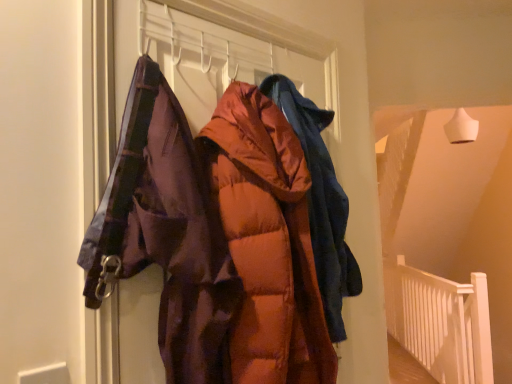
Question: Can you confirm if white wooden balustrade at lower right is smaller than matte orange puffer jacket at center, marked as the 2th jacket in a front-to-back arrangement?

Choices:
 (A) no
 (B) yes

Answer: (A)

Question: Considering the relative sizes of white wooden balustrade at lower right and matte orange puffer jacket at center, marked as the 2th jacket in a front-to-back arrangement, in the image provided, is white wooden balustrade at lower right bigger than matte orange puffer jacket at center, marked as the 2th jacket in a front-to-back arrangement,?

Choices:
 (A) yes
 (B) no

Answer: (A)

Question: Does white wooden balustrade at lower right have a greater width compared to matte orange puffer jacket at center, marked as the 2th jacket in a front-to-back arrangement?

Choices:
 (A) no
 (B) yes

Answer: (A)

Question: From a real-world perspective, is white wooden balustrade at lower right over matte orange puffer jacket at center, the first jacket in the back-to-front sequence?

Choices:
 (A) no
 (B) yes

Answer: (A)

Question: Is white wooden balustrade at lower right directly adjacent to matte orange puffer jacket at center, the first jacket in the back-to-front sequence?

Choices:
 (A) no
 (B) yes

Answer: (A)

Question: Looking at their shapes, would you say white wooden balustrade at lower right is wider or thinner than matte orange puffer jacket at center, the first jacket in the back-to-front sequence?

Choices:
 (A) thin
 (B) wide

Answer: (A)

Question: Considering the positions of white wooden balustrade at lower right and matte orange puffer jacket at center, marked as the 2th jacket in a front-to-back arrangement, in the image, is white wooden balustrade at lower right bigger or smaller than matte orange puffer jacket at center, marked as the 2th jacket in a front-to-back arrangement,?

Choices:
 (A) big
 (B) small

Answer: (A)

Question: Is white wooden balustrade at lower right inside the boundaries of matte orange puffer jacket at center, marked as the 2th jacket in a front-to-back arrangement, or outside?

Choices:
 (A) outside
 (B) inside

Answer: (A)

Question: In the image, is white wooden balustrade at lower right positioned in front of or behind matte orange puffer jacket at center, marked as the 2th jacket in a front-to-back arrangement?

Choices:
 (A) behind
 (B) front

Answer: (A)

Question: Considering the positions of matte orange puffer jacket at center, the first jacket in the back-to-front sequence, and white wooden balustrade at lower right in the image, is matte orange puffer jacket at center, the first jacket in the back-to-front sequence, taller or shorter than white wooden balustrade at lower right?

Choices:
 (A) tall
 (B) short

Answer: (B)

Question: Considering the relative positions of matte orange puffer jacket at center, marked as the 2th jacket in a front-to-back arrangement, and white wooden balustrade at lower right in the image provided, is matte orange puffer jacket at center, marked as the 2th jacket in a front-to-back arrangement, to the left or to the right of white wooden balustrade at lower right?

Choices:
 (A) right
 (B) left

Answer: (B)

Question: Is matte orange puffer jacket at center, marked as the 2th jacket in a front-to-back arrangement, inside the boundaries of white wooden balustrade at lower right, or outside?

Choices:
 (A) inside
 (B) outside

Answer: (B)

Question: Looking at their shapes, would you say matte orange puffer jacket at center, marked as the 2th jacket in a front-to-back arrangement, is wider or thinner than white wooden balustrade at lower right?

Choices:
 (A) thin
 (B) wide

Answer: (B)

Question: Considering their positions, is orange puffy jacket at center, the second jacket in the back-to-front sequence, located in front of or behind matte orange puffer jacket at center, marked as the 2th jacket in a front-to-back arrangement?

Choices:
 (A) behind
 (B) front

Answer: (B)

Question: Would you say orange puffy jacket at center, the second jacket in the back-to-front sequence, is inside or outside matte orange puffer jacket at center, marked as the 2th jacket in a front-to-back arrangement?

Choices:
 (A) inside
 (B) outside

Answer: (B)